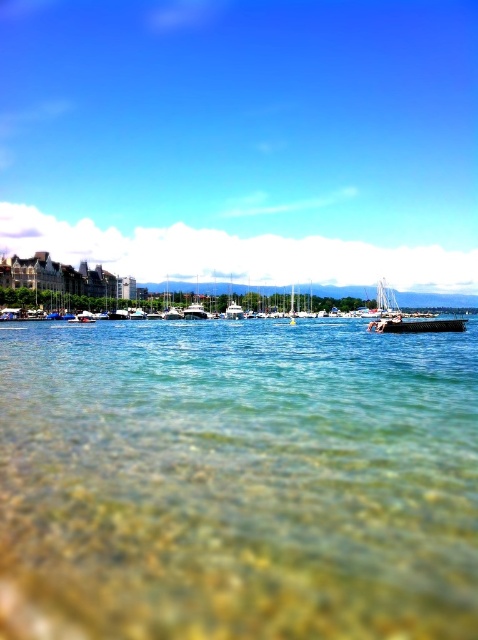
Which is above, clear water at center or transparent water at center?

transparent water at center is higher up.

Which of these two, clear water at center or transparent water at center, stands shorter?

Standing shorter between the two is clear water at center.

Is point (20, 614) positioned behind point (172, 61)?

No, (20, 614) is in front of (172, 61).

Locate an element on the screen. This screenshot has height=640, width=478. clear water at center is located at coordinates (237, 481).